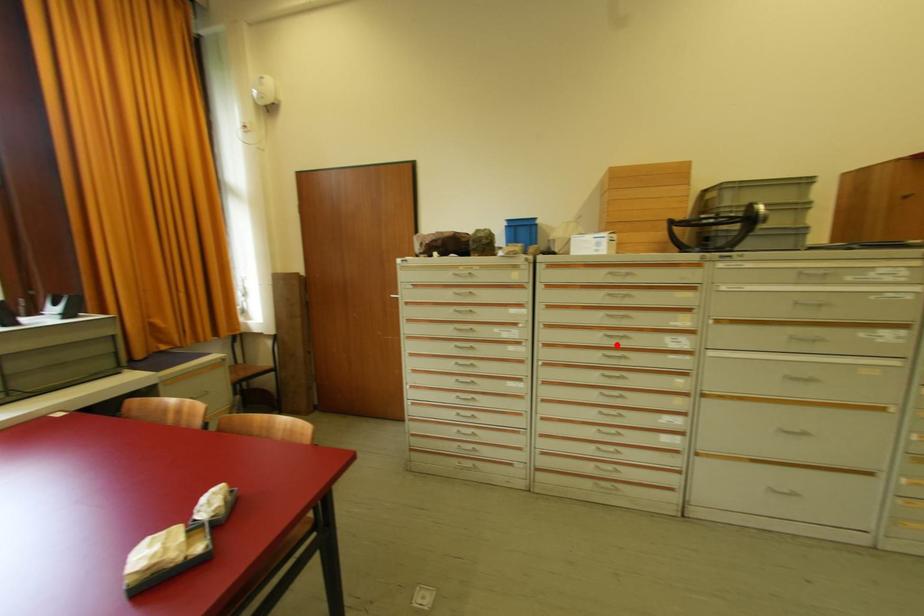
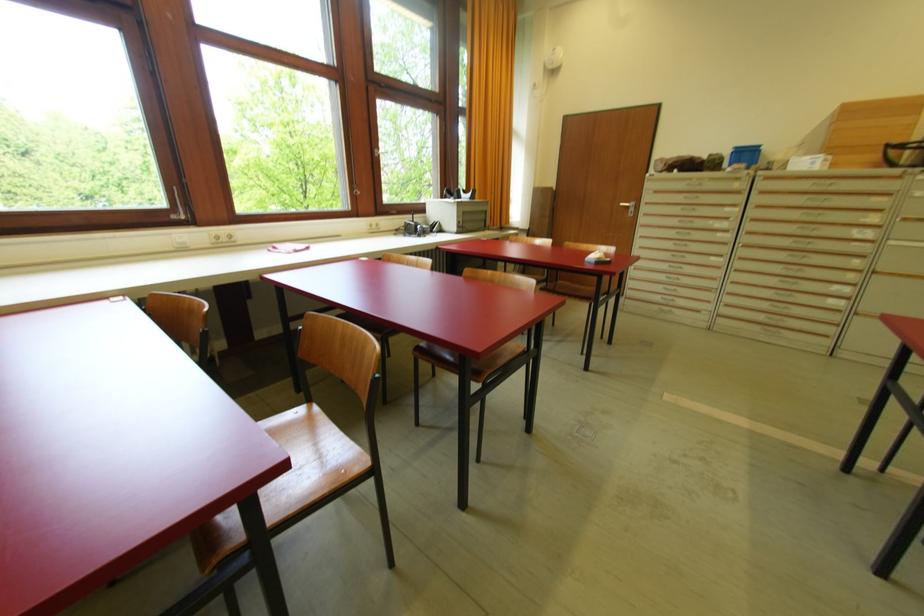
Find the pixel in the second image that matches the highlighted location in the first image.

(809, 235)